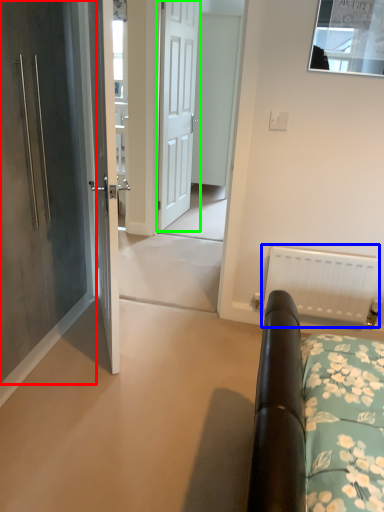
Question: Considering the real-world distances, which object is farthest from door (highlighted by a red box)? radiator (highlighted by a blue box) or door (highlighted by a green box)?

Choices:
 (A) radiator
 (B) door

Answer: (B)